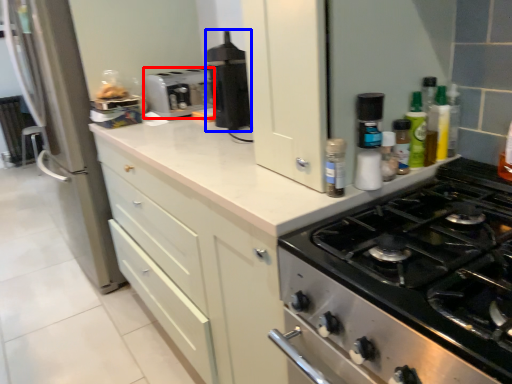
Question: Which of the following is the closest to the observer, toaster (highlighted by a red box) or kitchen appliance (highlighted by a blue box)?

Choices:
 (A) toaster
 (B) kitchen appliance

Answer: (B)